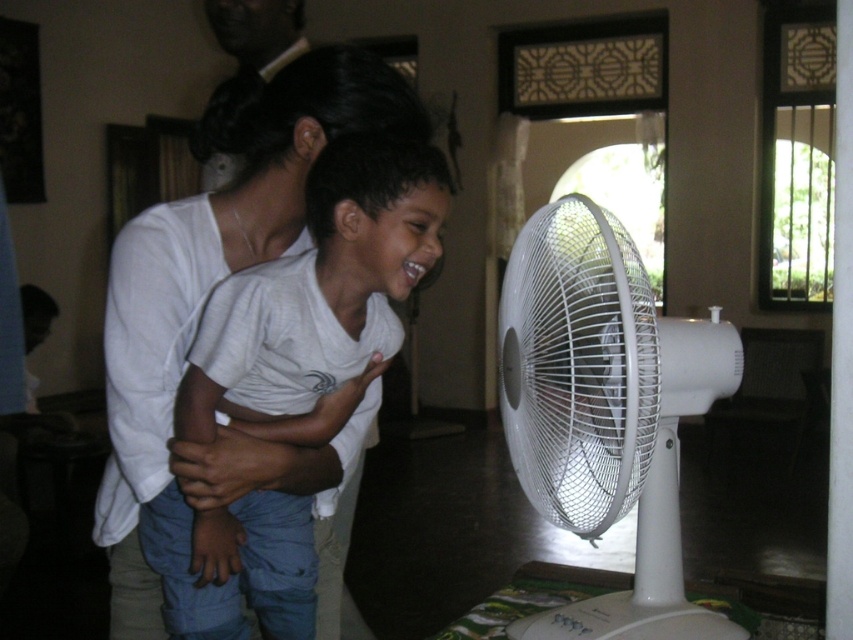
You are a delivery person who needs to place a small package on the floor near the white plastic mechanical fan at center. According to the room layout, where should you place the package?

The white plastic mechanical fan at center is located at point (605, 412), so you should place the package near that coordinate.